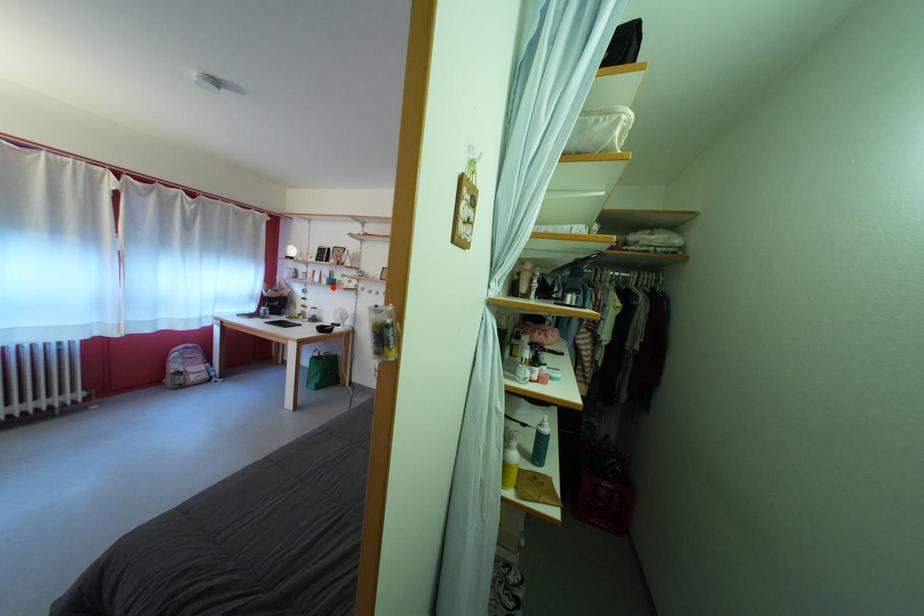
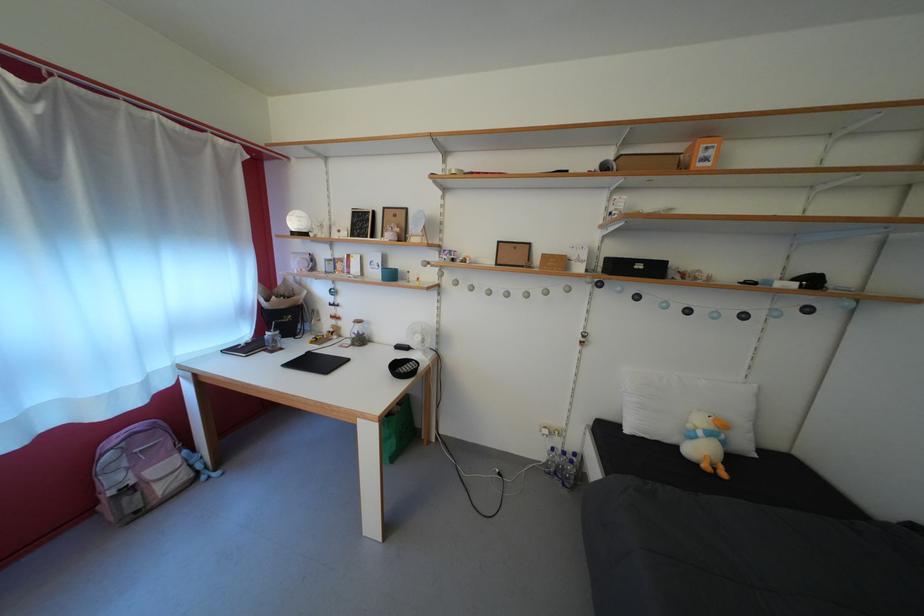
Where in the second image is the point corresponding to the highlighted location from the first image?

(383, 280)